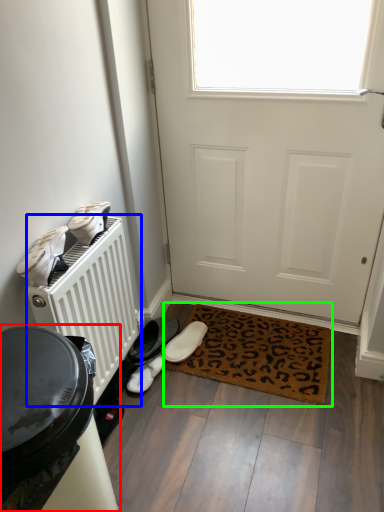
Question: Based on their relative distances, which object is farther from appliance (highlighted by a red box)? Choose from radiator (highlighted by a blue box) and mat (highlighted by a green box).

Choices:
 (A) radiator
 (B) mat

Answer: (B)